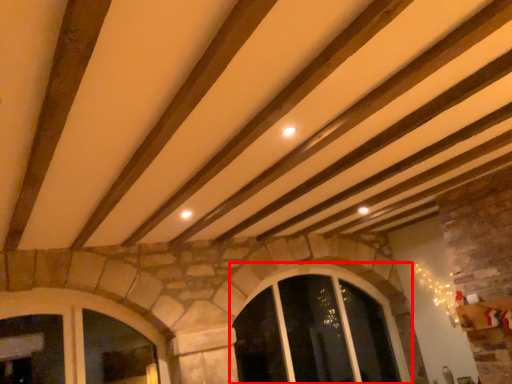
Question: Observing the image, what is the correct spatial positioning of window (annotated by the red box) in reference to window?

Choices:
 (A) right
 (B) left

Answer: (A)